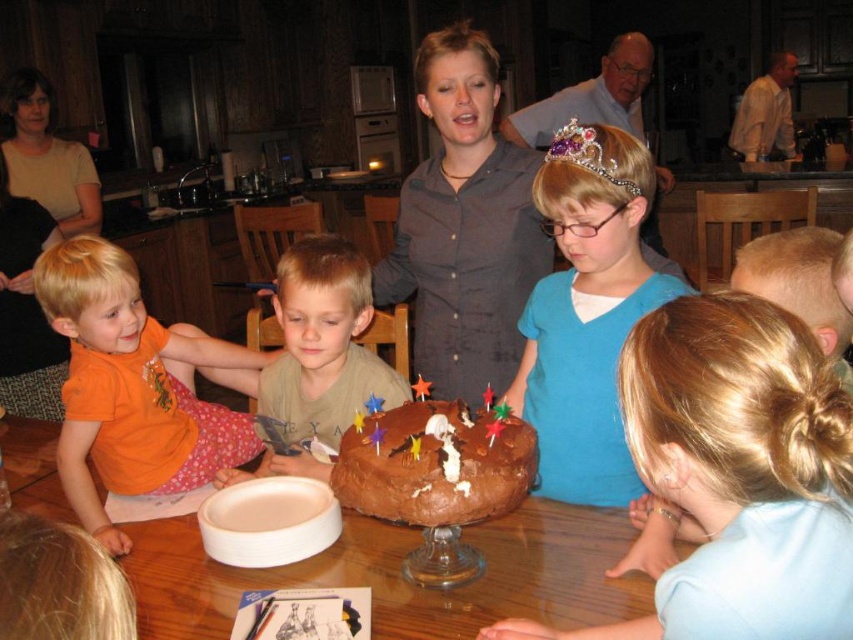
Between brown wooden table at center and orange cotton shirt at lower left, which one has more height?

Standing taller between the two is orange cotton shirt at lower left.

Who is shorter, brown wooden table at center or orange cotton shirt at lower left?

Standing shorter between the two is brown wooden table at center.

Locate an element on the screen. The height and width of the screenshot is (640, 853). brown wooden table at center is located at coordinates (401, 577).

Who is lower down, blue matte shirt at center or purple gemstone tiara at upper center?

blue matte shirt at center

Does blue matte shirt at center have a lesser width compared to purple gemstone tiara at upper center?

In fact, blue matte shirt at center might be wider than purple gemstone tiara at upper center.

Between point (544, 177) and point (560, 129), which one is positioned in front?

Point (544, 177) is in front.

Locate an element on the screen. blue matte shirt at center is located at coordinates (587, 312).

Is blue matte shirt at center positioned in front of orange cotton shirt at lower left?

Yes.

Is blue matte shirt at center wider than orange cotton shirt at lower left?

In fact, blue matte shirt at center might be narrower than orange cotton shirt at lower left.

Image resolution: width=853 pixels, height=640 pixels. What do you see at coordinates (587, 312) in the screenshot?
I see `blue matte shirt at center` at bounding box center [587, 312].

Locate an element on the screen. blue matte shirt at center is located at coordinates (587, 312).